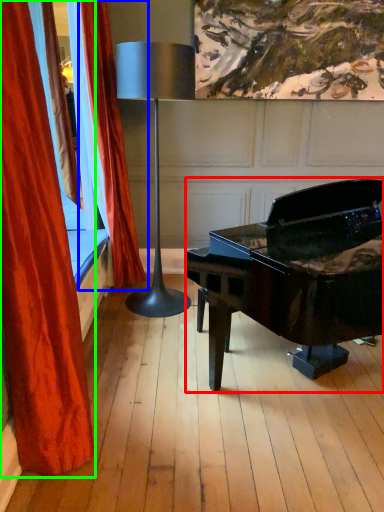
Question: Considering the real-world distances, which object is closest to piano (highlighted by a red box)? curtain (highlighted by a blue box) or curtain (highlighted by a green box).

Choices:
 (A) curtain
 (B) curtain

Answer: (A)